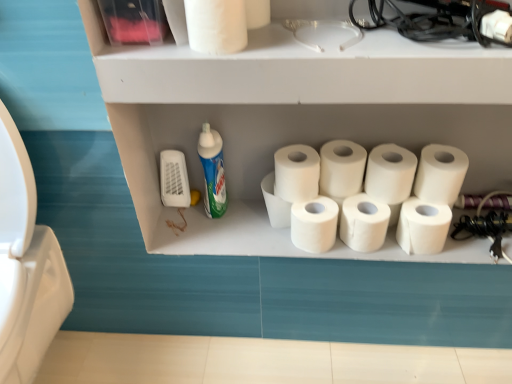
Question: Is white matte toilet paper at center, which is counted as the seventh toilet paper, starting from the right, touching white matte toilet paper at upper right, placed as the 10th toilet paper when sorted from left to right?

Choices:
 (A) yes
 (B) no

Answer: (B)

Question: Could you tell me if white matte toilet paper at center, which is counted as the fifth toilet paper, starting from the left, is turned towards white matte toilet paper at upper right, which is the 2th toilet paper from right to left?

Choices:
 (A) yes
 (B) no

Answer: (B)

Question: Are white matte toilet paper at center, which is counted as the seventh toilet paper, starting from the right, and white matte toilet paper at upper right, which is the 2th toilet paper from right to left, far apart?

Choices:
 (A) yes
 (B) no

Answer: (B)

Question: Would you say white matte toilet paper at center, which is counted as the seventh toilet paper, starting from the right, is outside white matte toilet paper at upper right, placed as the 10th toilet paper when sorted from left to right?

Choices:
 (A) yes
 (B) no

Answer: (A)

Question: Can you confirm if white matte toilet paper at center, which is counted as the fifth toilet paper, starting from the left, is taller than white matte toilet paper at upper right, placed as the 10th toilet paper when sorted from left to right?

Choices:
 (A) yes
 (B) no

Answer: (A)

Question: Is white matte toilet paper at upper center, acting as the tenth toilet paper starting from the right, in front of or behind white matte toilet paper at upper center, placed as the 1th toilet paper when sorted from left to right, in the image?

Choices:
 (A) front
 (B) behind

Answer: (B)

Question: Is white matte toilet paper at upper center, acting as the tenth toilet paper starting from the right, wider or thinner than white matte toilet paper at upper center, the 11th toilet paper in the right-to-left sequence?

Choices:
 (A) thin
 (B) wide

Answer: (A)

Question: Do you think white matte toilet paper at upper center, acting as the tenth toilet paper starting from the right, is within white matte toilet paper at upper center, the 11th toilet paper in the right-to-left sequence, or outside of it?

Choices:
 (A) outside
 (B) inside

Answer: (A)

Question: From their relative heights in the image, would you say white matte toilet paper at upper center, acting as the tenth toilet paper starting from the right, is taller or shorter than white matte toilet paper at upper center, the 11th toilet paper in the right-to-left sequence?

Choices:
 (A) short
 (B) tall

Answer: (B)

Question: Is white matte toilet paper at right, which is the first toilet paper from right to left, taller or shorter than blue glossy bottle at center-left?

Choices:
 (A) tall
 (B) short

Answer: (B)

Question: Is white matte toilet paper at right, which is the first toilet paper from right to left, bigger or smaller than blue glossy bottle at center-left?

Choices:
 (A) small
 (B) big

Answer: (A)

Question: Is point click(437, 155) positioned closer to the camera than point click(204, 173)?

Choices:
 (A) farther
 (B) closer

Answer: (B)

Question: From a real-world perspective, is white matte toilet paper at right, which is the first toilet paper from right to left, above or below blue glossy bottle at center-left?

Choices:
 (A) below
 (B) above

Answer: (B)

Question: In terms of height, does white matte toilet paper at center, which is the 8th toilet paper from left to right, look taller or shorter compared to white matte toilet paper at center, which is counted as the fifth toilet paper, starting from the left?

Choices:
 (A) short
 (B) tall

Answer: (B)

Question: Is white matte toilet paper at center, which is the 8th toilet paper from left to right, inside or outside of white matte toilet paper at center, which is counted as the seventh toilet paper, starting from the right?

Choices:
 (A) inside
 (B) outside

Answer: (B)